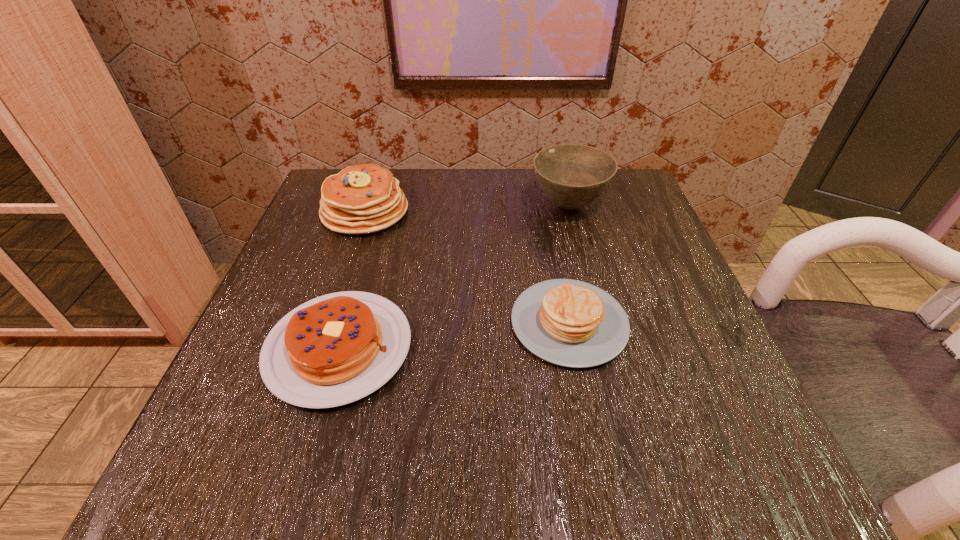
Find the location of `bowl`. bowl is located at coordinates (572, 176).

I want to click on the farthest pancake, so click(361, 199).

Locate an element on the screen. The height and width of the screenshot is (540, 960). the rightmost pancake is located at coordinates (570, 323).

Find the location of a particular element. free point located on the left of the bowl is located at coordinates (454, 205).

Where is `vacant space located on the right of the tallest pancake`? The height and width of the screenshot is (540, 960). vacant space located on the right of the tallest pancake is located at coordinates (509, 212).

Locate an element on the screen. This screenshot has width=960, height=540. vacant position located on the back of the rightmost pancake is located at coordinates (548, 216).

Identify the location of bowl located at the far edge. (572, 176).

The image size is (960, 540). Identify the location of pancake present at the far edge. (361, 199).

Identify the location of bowl present at the right edge. The height and width of the screenshot is (540, 960). (572, 176).

Identify the location of pancake that is at the right edge. This screenshot has height=540, width=960. (570, 323).